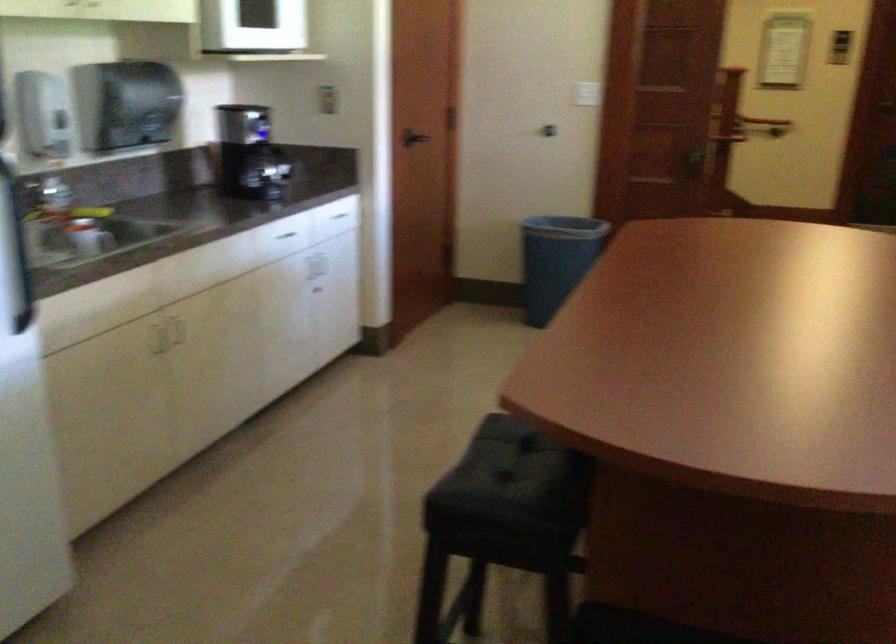
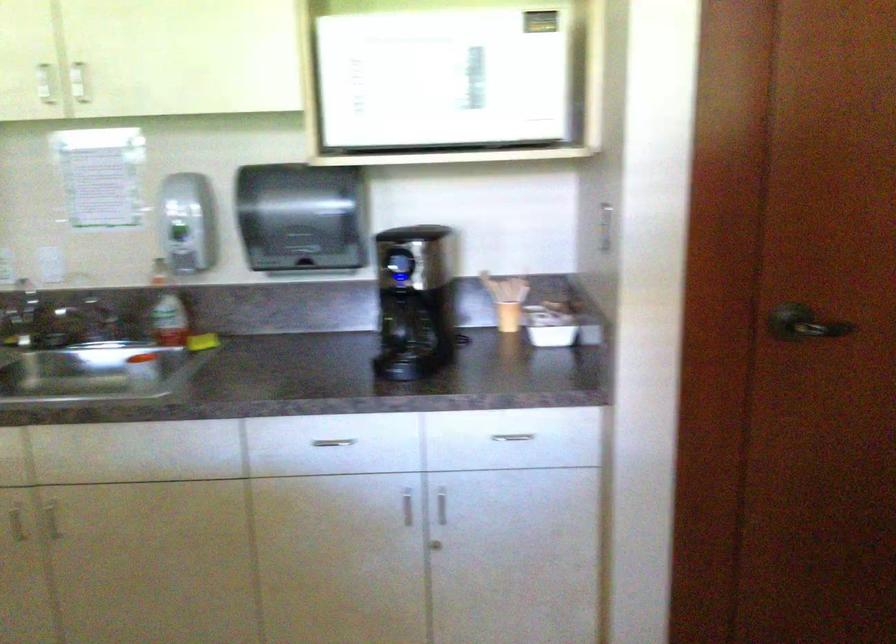
The point at (305, 270) is marked in the first image. Where is the corresponding point in the second image?

(407, 506)